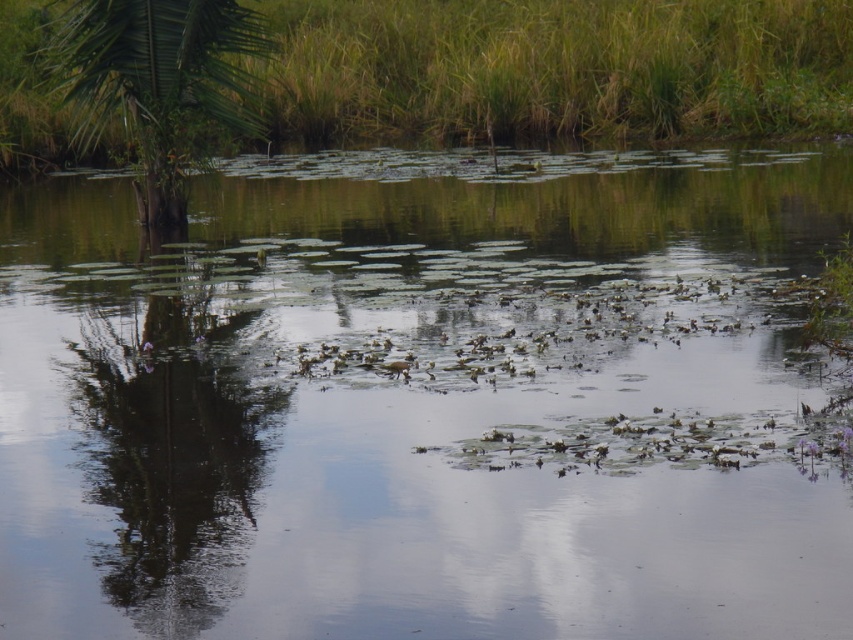
You are a bird flying over the wetland scene. You need to land on the largest green area between the green grass at upper center and the green leafy palm tree at left. Which one should you choose?

The green grass at upper center is larger in size than the green leafy palm tree at left, so you should choose the green grass at upper center to land on.

You are a bird looking for a place to land. You see the green grass at upper center and the green leafy palm tree at left. Which location has a wider area to land on?

The green grass at upper center has a wider area to land on because its width is larger than the green leafy palm tree at left.

You are standing in the wetland and want to hide behind the tallest vegetation. Which one should you choose between the green grass at upper center and the green leafy palm tree at left?

The green grass at upper center is taller than the green leafy palm tree at left, so you should choose the green grass at upper center to hide behind.